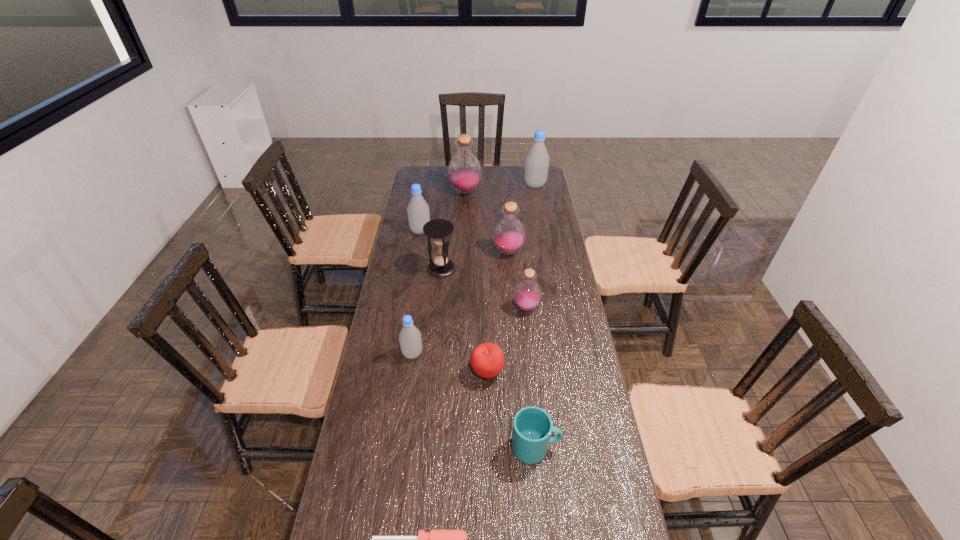
Where is `vacant space located on the right of the nearest gray bottle`? This screenshot has width=960, height=540. vacant space located on the right of the nearest gray bottle is located at coordinates (532, 354).

Where is `vacant space located 0.220m on the front of the fifth farthest bottle`? This screenshot has width=960, height=540. vacant space located 0.220m on the front of the fifth farthest bottle is located at coordinates (533, 367).

Where is `free space located 0.100m on the handle side of the cup`? This screenshot has height=540, width=960. free space located 0.100m on the handle side of the cup is located at coordinates (595, 447).

Find the location of a particular element. vacant region located 0.380m on the front of the apple is located at coordinates (490, 514).

At what (x,y) coordinates should I click in order to perform the action: click on hourglass located in the left edge section of the desktop. Please return your answer as a coordinate pair (x, y). This screenshot has height=540, width=960. Looking at the image, I should click on [438, 230].

The image size is (960, 540). I want to click on cup at the right edge, so click(532, 427).

In order to click on object located in the far right corner section of the desktop in this screenshot , I will do 537,159.

What are the coordinates of `vacant space at the far edge of the desktop` in the screenshot? It's located at (444, 176).

In the image, there is a desktop. Where is `vacant space at the left edge`? This screenshot has width=960, height=540. vacant space at the left edge is located at coordinates (374, 335).

I want to click on vacant area at the right edge of the desktop, so click(x=554, y=272).